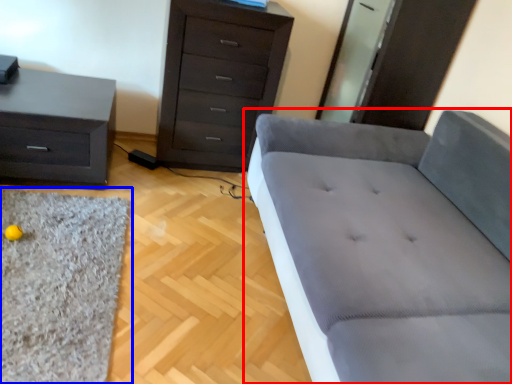
Question: Which object appears farthest to the camera in this image, studio couch (highlighted by a red box) or mat (highlighted by a blue box)?

Choices:
 (A) studio couch
 (B) mat

Answer: (B)